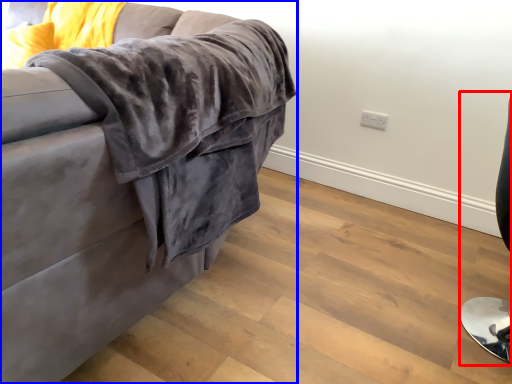
Question: Which object is closer to the camera taking this photo, computer chair (highlighted by a red box) or studio couch (highlighted by a blue box)?

Choices:
 (A) computer chair
 (B) studio couch

Answer: (B)